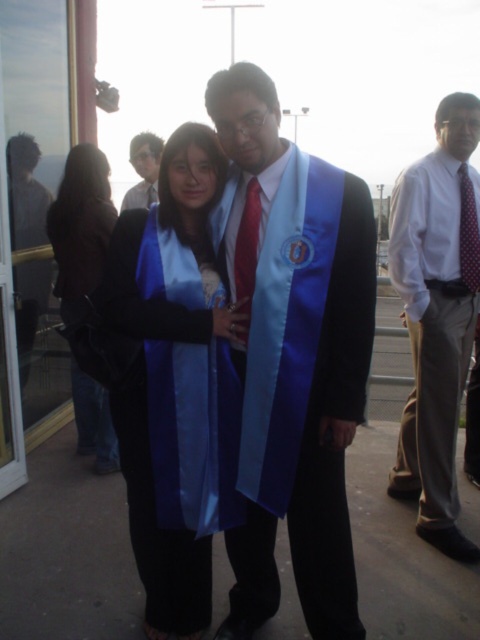
You are a photographer at a graduation ceremony. You need to capture a photo of the two graduates wearing a satin blue sash at center and a white shirt at center. Based on their positions, which one should you focus on first to ensure both are in frame?

The satin blue sash at center is to the left of the white shirt at center, so you should focus on the white shirt at center first as it is on the right side to ensure both are in frame.